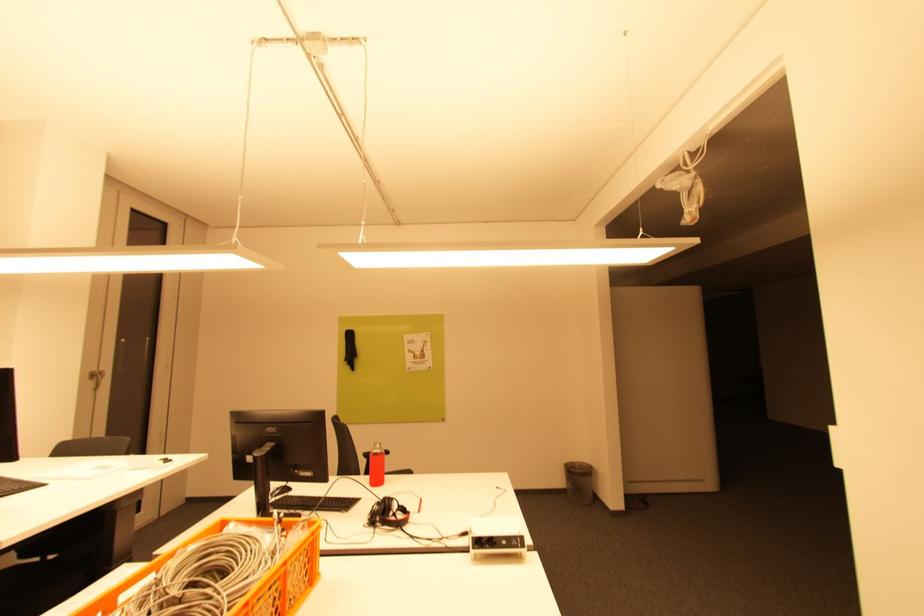
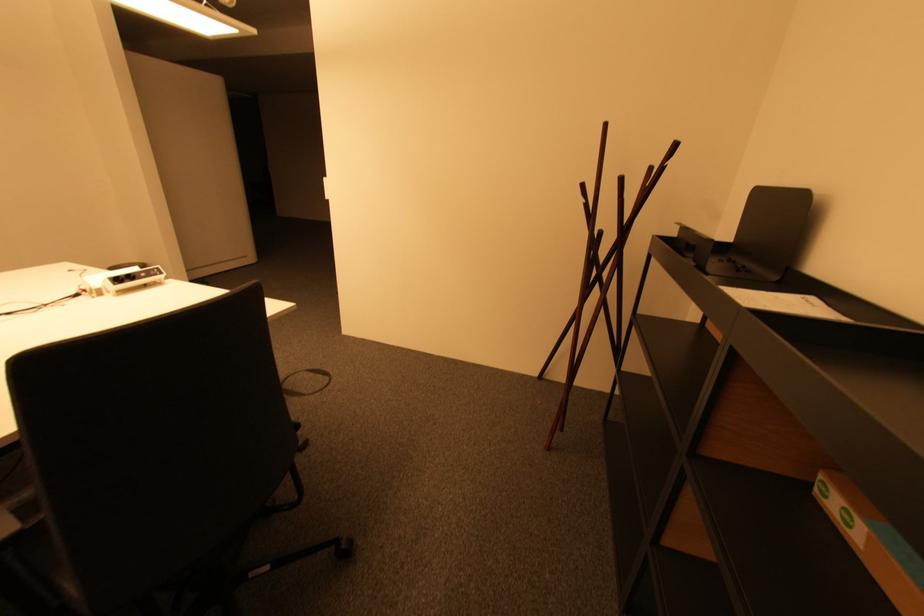
First-person continuous shooting, in which direction is the camera rotating?

The camera rotated toward right-down.